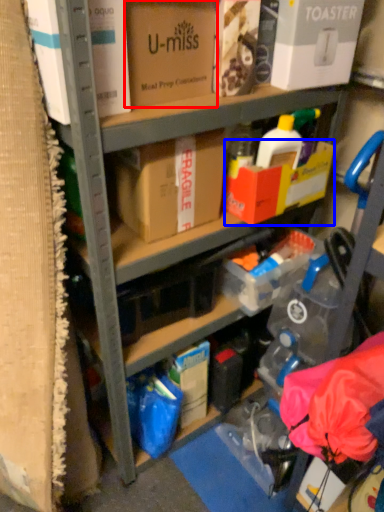
Question: Which point is further to the camera, box (highlighted by a red box) or box (highlighted by a blue box)?

Choices:
 (A) box
 (B) box

Answer: (B)